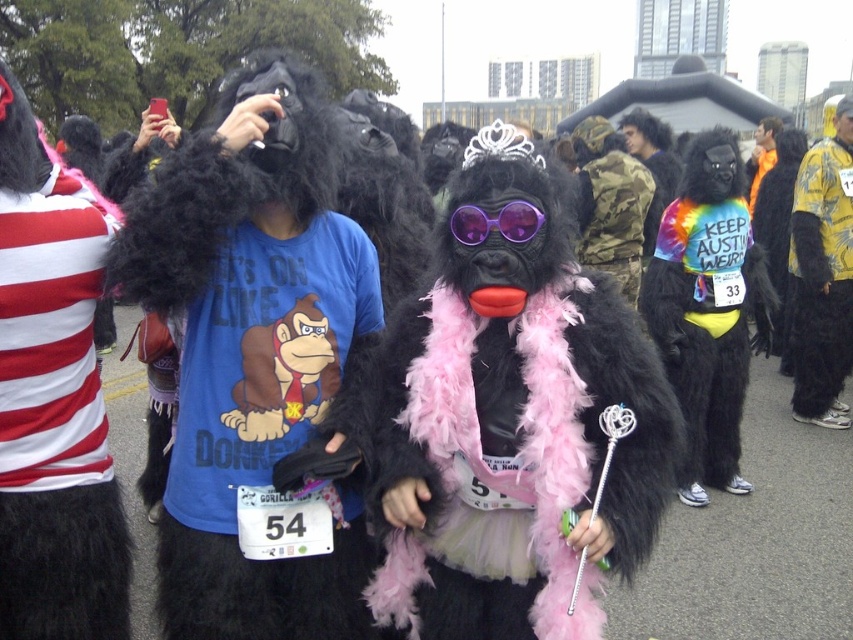
Measure the distance from camo fabric uniform at center to purple plastic goggles at center.

They are 14.19 feet apart.

Does camo fabric uniform at center have a greater height compared to purple plastic goggles at center?

Yes.

What do you see at coordinates (610, 204) in the screenshot? I see `camo fabric uniform at center` at bounding box center [610, 204].

Where is `camo fabric uniform at center`? The height and width of the screenshot is (640, 853). camo fabric uniform at center is located at coordinates (610, 204).

Is yellow printed shirt at right shorter than camo fabric uniform at center?

Incorrect, yellow printed shirt at right's height does not fall short of camo fabric uniform at center's.

Measure the distance between yellow printed shirt at right and camera.

A distance of 6.02 meters exists between yellow printed shirt at right and camera.

The width and height of the screenshot is (853, 640). What do you see at coordinates (822, 275) in the screenshot?
I see `yellow printed shirt at right` at bounding box center [822, 275].

Find the location of `yellow printed shirt at right`. yellow printed shirt at right is located at coordinates (822, 275).

How much distance is there between yellow printed shirt at right and purple plastic goggles at center?

The distance of yellow printed shirt at right from purple plastic goggles at center is 4.64 meters.

Between yellow printed shirt at right and purple plastic goggles at center, which one is positioned higher?

yellow printed shirt at right is above.

Identify the location of yellow printed shirt at right. (822, 275).